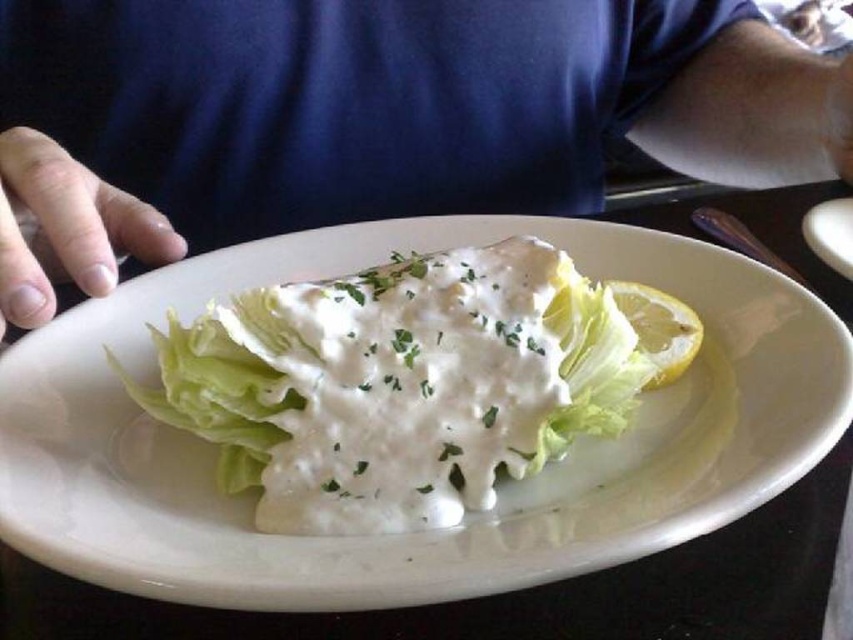
Is blue fabric shirt at upper center smaller than green leafy lettuce at center?

No, blue fabric shirt at upper center is not smaller than green leafy lettuce at center.

Who is taller, blue fabric shirt at upper center or green leafy lettuce at center?

blue fabric shirt at upper center is taller.

Consider the image. Who is more forward, (682, 1) or (440, 448)?

Positioned in front is point (440, 448).

The width and height of the screenshot is (853, 640). What are the coordinates of `blue fabric shirt at upper center` in the screenshot? It's located at (419, 104).

Is point (798, 140) in front of point (686, 346)?

No, it is not.

Who is taller, blue fabric shirt at upper center or yellow smooth lemon at upper right?

Standing taller between the two is blue fabric shirt at upper center.

Is point (277, 13) behind point (618, 284)?

Yes.

What are the coordinates of `blue fabric shirt at upper center` in the screenshot? It's located at (419, 104).

Based on the photo, which of these two, green leafy lettuce at center or yellow smooth lemon at upper right, stands taller?

green leafy lettuce at center

Is point (361, 424) farther from camera compared to point (650, 288)?

No, it is not.

Who is more forward, (331, 300) or (616, 289)?

Point (331, 300)

Find the location of a particular element. This screenshot has height=640, width=853. green leafy lettuce at center is located at coordinates (398, 385).